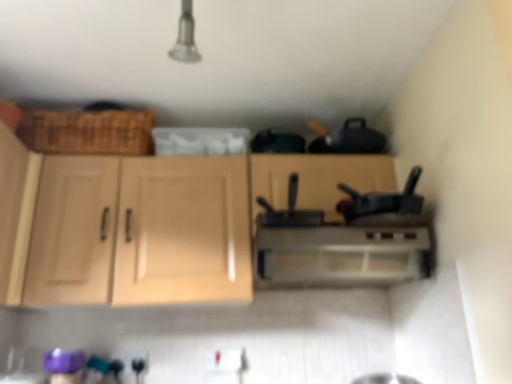
Question: Is black matte pan at center wider than light wood cabinet at center, positioned as the 2th cabinetry in left-to-right order?

Choices:
 (A) yes
 (B) no

Answer: (A)

Question: Can you confirm if black matte pan at center is thinner than light wood cabinet at center, positioned as the 2th cabinetry in left-to-right order?

Choices:
 (A) yes
 (B) no

Answer: (B)

Question: Is light wood cabinet at center, positioned as the 2th cabinetry in left-to-right order, completely or partially inside black matte pan at center?

Choices:
 (A) no
 (B) yes

Answer: (A)

Question: Does black matte pan at center have a larger size compared to light wood cabinet at center, positioned as the 2th cabinetry in left-to-right order?

Choices:
 (A) yes
 (B) no

Answer: (B)

Question: Is black matte pan at center not near light wood cabinet at center, positioned as the 2th cabinetry in left-to-right order?

Choices:
 (A) yes
 (B) no

Answer: (B)

Question: Would you say satin silver range hood at center is inside or outside light wood cabinet at center, positioned as the 2th cabinetry in left-to-right order?

Choices:
 (A) inside
 (B) outside

Answer: (A)

Question: Is point coord(305,279) closer or farther from the camera than point coord(156,177)?

Choices:
 (A) farther
 (B) closer

Answer: (A)

Question: Considering the positions of satin silver range hood at center and light wood cabinet at center, the 1th cabinetry in the right-to-left sequence, in the image, is satin silver range hood at center taller or shorter than light wood cabinet at center, the 1th cabinetry in the right-to-left sequence,?

Choices:
 (A) tall
 (B) short

Answer: (B)

Question: From a real-world perspective, is satin silver range hood at center physically located above or below light wood cabinet at center, positioned as the 2th cabinetry in left-to-right order?

Choices:
 (A) above
 (B) below

Answer: (B)

Question: From the image's perspective, is black matte pan at center located above or below light wood cabinet at left, the 1th cabinetry from the left?

Choices:
 (A) above
 (B) below

Answer: (A)

Question: In the image, is black matte pan at center on the left side or the right side of light wood cabinet at left, the 1th cabinetry from the left?

Choices:
 (A) right
 (B) left

Answer: (A)

Question: Looking at their shapes, would you say black matte pan at center is wider or thinner than light wood cabinet at left, which is the 2th cabinetry in right-to-left order?

Choices:
 (A) wide
 (B) thin

Answer: (A)

Question: Is black matte pan at center in front of or behind light wood cabinet at left, the 1th cabinetry from the left, in the image?

Choices:
 (A) front
 (B) behind

Answer: (B)

Question: Is black matte pan at center inside the boundaries of satin silver range hood at center, or outside?

Choices:
 (A) outside
 (B) inside

Answer: (A)

Question: Based on their positions, is black matte pan at center located to the left or right of satin silver range hood at center?

Choices:
 (A) left
 (B) right

Answer: (A)